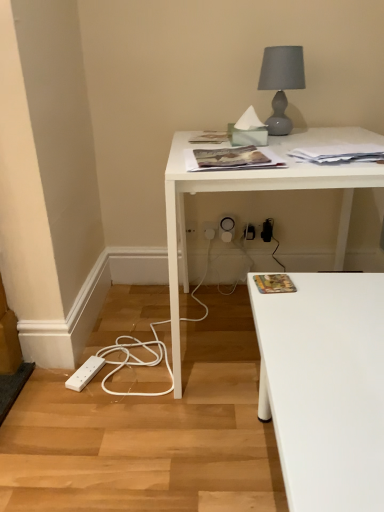
This screenshot has height=512, width=384. Find the location of `free location above white paper at upper right, arranged as the second magazine when ordered from the bottom (from a real-world perspective)`. free location above white paper at upper right, arranged as the second magazine when ordered from the bottom (from a real-world perspective) is located at coordinates (346, 146).